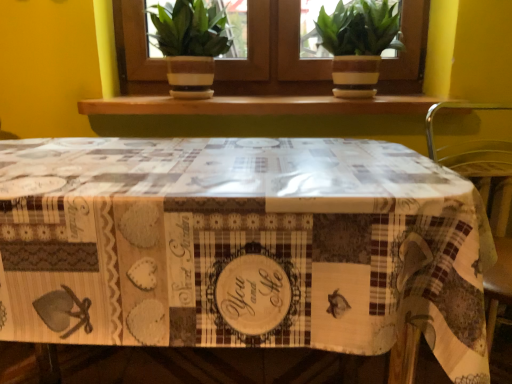
Question: From a real-world perspective, is green matte houseplant at upper center, which is the 1th houseplant from right to left, physically located above or below green leafy plant at upper center?

Choices:
 (A) below
 (B) above

Answer: (A)

Question: Looking at the image, does green matte houseplant at upper center, which is the 2th houseplant from left to right, seem bigger or smaller compared to green leafy plant at upper center?

Choices:
 (A) small
 (B) big

Answer: (B)

Question: Estimate the real-world distances between objects in this image. Which object is farther from the green leafy plant at upper center?

Choices:
 (A) wooden at upper center
 (B) green matte plant at upper center, which appears as the 2th houseplant when viewed from the right
 (C) green matte houseplant at upper center, which is the 2th houseplant from left to right
 (D) printed fabric tablecloth at center
 (E) metallic green chair at right

Answer: (D)

Question: Based on their relative distances, which object is nearer to the green leafy plant at upper center?

Choices:
 (A) green matte houseplant at upper center, which is the 2th houseplant from left to right
 (B) wooden at upper center
 (C) green matte plant at upper center, the first houseplant in the left-to-right sequence
 (D) printed fabric tablecloth at center
 (E) metallic green chair at right

Answer: (A)